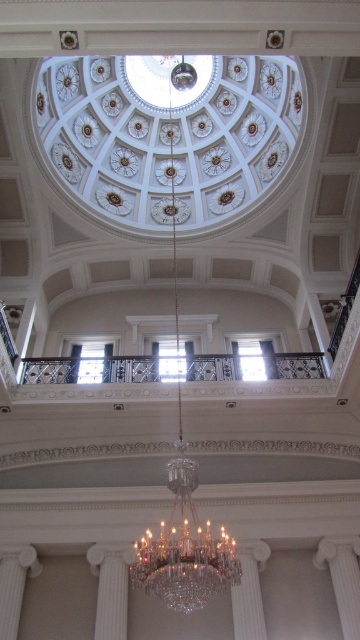
Question: Is the position of crystal at center less distant than that of metallic/ornate balustrade at center?

Choices:
 (A) yes
 (B) no

Answer: (A)

Question: Which object appears farthest from the camera in this image?

Choices:
 (A) white glossy pillar at lower left
 (B) white marble pillar at lower left

Answer: (A)

Question: Which object appears closest to the camera in this image?

Choices:
 (A) white glossy column at center
 (B) crystal at center

Answer: (B)

Question: Can you confirm if crystal at center is positioned to the left of white marble pillar at lower left?

Choices:
 (A) no
 (B) yes

Answer: (A)

Question: Can you confirm if crystal at center is positioned below white marble pillar at lower left?

Choices:
 (A) yes
 (B) no

Answer: (B)

Question: Which of these objects is positioned closest to the white glossy pillar at lower left?

Choices:
 (A) metallic/ornate balustrade at center
 (B) white glossy pillar at lower right

Answer: (A)